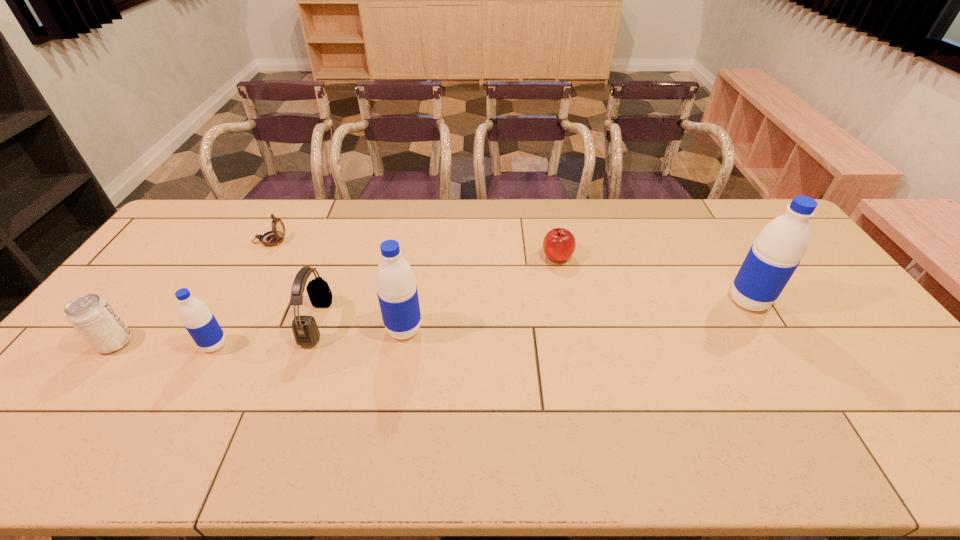
The image size is (960, 540). I want to click on object that can be found as the fourth closest to the soda can, so click(397, 292).

Find the location of `object that is the second nearest to the compass`. object that is the second nearest to the compass is located at coordinates (197, 318).

Locate which water bottle ranks third in proximity to the fifth tallest object. Please provide its 2D coordinates. Your answer should be formatted as a tuple, i.e. [(x, y)], where the tuple contains the x and y coordinates of a point satisfying the conditions above.

[(777, 251)]

Where is `water bottle that stands as the third closest to the headset`? The image size is (960, 540). water bottle that stands as the third closest to the headset is located at coordinates (777, 251).

In order to click on vacant space that satisfies the following two spatial constraints: 1. on the face of the compass; 2. on the left side of the second object from right to left in this screenshot , I will do `click(260, 256)`.

You are a GUI agent. You are given a task and a screenshot of the screen. Output one action in this format:
    pyautogui.click(x=<x>, y=<y>)
    Task: Click on the vacant space that satisfies the following two spatial constraints: 1. on the front side of the rightmost object; 2. on the left side of the apple
    The image size is (960, 540).
    Given the screenshot: What is the action you would take?
    pyautogui.click(x=566, y=301)

The image size is (960, 540). Find the location of `free space that satisfies the following two spatial constraints: 1. on the back side of the shortest water bottle; 2. on the right side of the rightmost object`. free space that satisfies the following two spatial constraints: 1. on the back side of the shortest water bottle; 2. on the right side of the rightmost object is located at coordinates (239, 301).

This screenshot has height=540, width=960. In order to click on free point that satisfies the following two spatial constraints: 1. on the face of the second water bottle from left to right; 2. on the right side of the compass in this screenshot , I will do `click(220, 329)`.

Image resolution: width=960 pixels, height=540 pixels. Identify the location of free space in the image that satisfies the following two spatial constraints: 1. on the back side of the leftmost water bottle; 2. on the face of the compass. (273, 240).